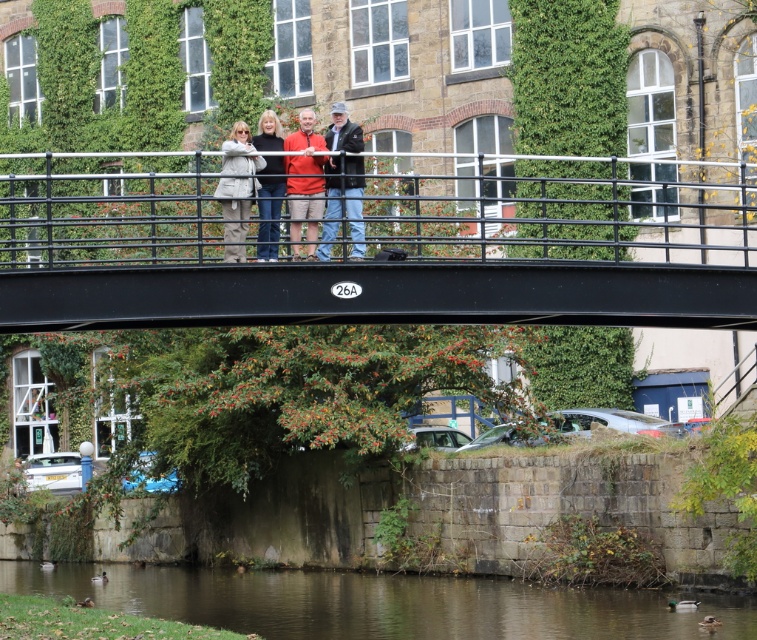
Question: Is black metal bridge at center bigger than light gray fabric jacket at center?

Choices:
 (A) yes
 (B) no

Answer: (A)

Question: Does matte red shirt at center come behind matte black jacket at center?

Choices:
 (A) no
 (B) yes

Answer: (A)

Question: Which point is farther to the camera?

Choices:
 (A) (575, 250)
 (B) (235, 182)

Answer: (A)

Question: Which point is farther to the camera?

Choices:
 (A) black metal bridge at center
 (B) greenish-brown water at lower center
 (C) light gray fabric jacket at center

Answer: (B)

Question: Based on their relative distances, which object is farther from the black metal bridge at center?

Choices:
 (A) greenish-brown water at lower center
 (B) matte black jackets at center
 (C) light gray fabric jacket at center
 (D) dark blue jacket at center

Answer: (D)

Question: Can you confirm if black metal bridge at center is bigger than greenish-brown water at lower center?

Choices:
 (A) no
 (B) yes

Answer: (B)